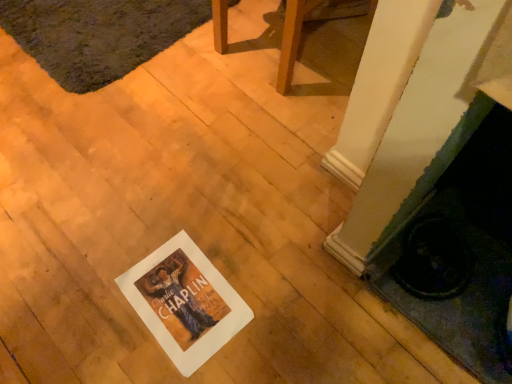
Question: Is wooden chair at center at the left side of white paper at center?

Choices:
 (A) no
 (B) yes

Answer: (A)

Question: Is wooden chair at center smaller than white paper at center?

Choices:
 (A) yes
 (B) no

Answer: (B)

Question: Does wooden chair at center appear on the right side of white paper at center?

Choices:
 (A) yes
 (B) no

Answer: (A)

Question: From a real-world perspective, does wooden chair at center sit lower than white paper at center?

Choices:
 (A) no
 (B) yes

Answer: (A)

Question: Can you confirm if wooden chair at center is thinner than white paper at center?

Choices:
 (A) no
 (B) yes

Answer: (A)

Question: Is wooden chair at center further to the viewer compared to white paper at center?

Choices:
 (A) yes
 (B) no

Answer: (A)

Question: From the image's perspective, does wooden chair at center appear lower than dark gray shaggy rug at upper left?

Choices:
 (A) yes
 (B) no

Answer: (A)

Question: Is wooden chair at center outside dark gray shaggy rug at upper left?

Choices:
 (A) no
 (B) yes

Answer: (B)

Question: Is dark gray shaggy rug at upper left a part of wooden chair at center?

Choices:
 (A) no
 (B) yes

Answer: (A)

Question: Is wooden chair at center to the left of dark gray shaggy rug at upper left from the viewer's perspective?

Choices:
 (A) yes
 (B) no

Answer: (B)

Question: Is wooden chair at center wider than dark gray shaggy rug at upper left?

Choices:
 (A) no
 (B) yes

Answer: (A)

Question: Does wooden chair at center come behind dark gray shaggy rug at upper left?

Choices:
 (A) no
 (B) yes

Answer: (A)

Question: Is dark gray shaggy rug at upper left taller than wooden chair at center?

Choices:
 (A) yes
 (B) no

Answer: (B)